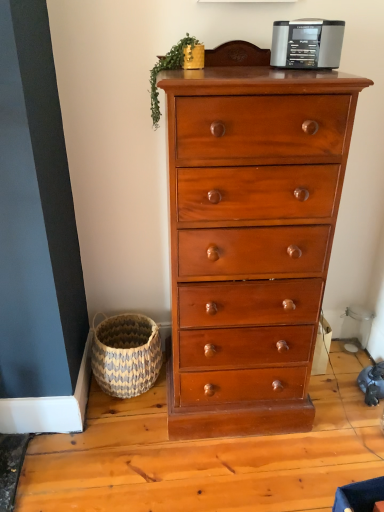
Where is `metallic gray radio at upper center`? This screenshot has width=384, height=512. metallic gray radio at upper center is located at coordinates (307, 42).

The height and width of the screenshot is (512, 384). Describe the element at coordinates (167, 69) in the screenshot. I see `green leafy plant at upper center` at that location.

You are a GUI agent. You are given a task and a screenshot of the screen. Output one action in this format:
    pyautogui.click(x=<x>, y=<y>)
    Task: Click on the metallic gray radio at upper center
    The image size is (384, 512).
    Given the screenshot: What is the action you would take?
    pyautogui.click(x=307, y=42)

From the image's perspective, which one is positioned lower, shiny brown wood chest of drawers at center or green leafy plant at upper center?

shiny brown wood chest of drawers at center appears lower in the image.

Looking at this image, is shiny brown wood chest of drawers at center further to camera compared to green leafy plant at upper center?

No, the depth of shiny brown wood chest of drawers at center is less than that of green leafy plant at upper center.

From a real-world perspective, which is physically below, shiny brown wood chest of drawers at center or green leafy plant at upper center?

shiny brown wood chest of drawers at center is physically lower.

Is woven natural basket at lower left far away from shiny brown wood chest of drawers at center?

No, there isn't a large distance between woven natural basket at lower left and shiny brown wood chest of drawers at center.

Is woven natural basket at lower left outside of shiny brown wood chest of drawers at center?

Yes.

Is woven natural basket at lower left oriented away from shiny brown wood chest of drawers at center?

No.

Can you confirm if woven natural basket at lower left is taller than shiny brown wood chest of drawers at center?

No.

Does metallic gray radio at upper center turn towards green leafy plant at upper center?

Result: No, metallic gray radio at upper center is not aimed at green leafy plant at upper center.

Locate an element on the screen. This screenshot has height=512, width=384. plant on the left of metallic gray radio at upper center is located at coordinates (167, 69).

Is shiny brown wood chest of drawers at center not close to woven natural basket at lower left?

No, shiny brown wood chest of drawers at center is not far away from woven natural basket at lower left.

From the image's perspective, does shiny brown wood chest of drawers at center appear lower than woven natural basket at lower left?

Incorrect, from the image's perspective, shiny brown wood chest of drawers at center is higher than woven natural basket at lower left.

Is shiny brown wood chest of drawers at center wider than woven natural basket at lower left?

Indeed, shiny brown wood chest of drawers at center has a greater width compared to woven natural basket at lower left.

Looking at the image, does shiny brown wood chest of drawers at center seem bigger or smaller compared to woven natural basket at lower left?

Clearly, shiny brown wood chest of drawers at center is larger in size than woven natural basket at lower left.

Is green leafy plant at upper center positioned with its back to woven natural basket at lower left?

No, green leafy plant at upper center is not facing away from woven natural basket at lower left.

Is point (183, 46) in front of point (140, 373)?

Yes.

Would you say woven natural basket at lower left is part of green leafy plant at upper center's contents?

That's incorrect, woven natural basket at lower left is not inside green leafy plant at upper center.

From a real-world perspective, which object rests below the other?

green leafy plant at upper center, from a real-world perspective.

Is green leafy plant at upper center positioned with its back to metallic gray radio at upper center?

green leafy plant at upper center is not turned away from metallic gray radio at upper center.

From the image's perspective, is green leafy plant at upper center under metallic gray radio at upper center?

Correct, green leafy plant at upper center appears lower than metallic gray radio at upper center in the image.

Consider the image. Between green leafy plant at upper center and metallic gray radio at upper center, which one is positioned in front?

metallic gray radio at upper center is more forward.

From the image's perspective, is shiny brown wood chest of drawers at center beneath metallic gray radio at upper center?

Yes, from the image's perspective, shiny brown wood chest of drawers at center is beneath metallic gray radio at upper center.

Considering the points (182, 96) and (305, 42), which point is in front, point (182, 96) or point (305, 42)?

Point (182, 96)

How far apart are shiny brown wood chest of drawers at center and metallic gray radio at upper center?

They are 49.90 centimeters apart.

Can you confirm if shiny brown wood chest of drawers at center is positioned to the right of metallic gray radio at upper center?

Incorrect, shiny brown wood chest of drawers at center is not on the right side of metallic gray radio at upper center.

You are a GUI agent. You are given a task and a screenshot of the screen. Output one action in this format:
    pyautogui.click(x=<x>, y=<y>)
    Task: Click on the plant above the shiny brown wood chest of drawers at center (from a real-world perspective)
    
    Given the screenshot: What is the action you would take?
    pyautogui.click(x=167, y=69)

Find the location of a particular element. The image size is (384, 512). basket that appears on the left of shiny brown wood chest of drawers at center is located at coordinates (126, 354).

Based on their spatial positions, is metallic gray radio at upper center or woven natural basket at lower left further from shiny brown wood chest of drawers at center?

metallic gray radio at upper center is positioned further to the anchor shiny brown wood chest of drawers at center.

Looking at the image, which one is located further to green leafy plant at upper center, woven natural basket at lower left or metallic gray radio at upper center?

Among the two, woven natural basket at lower left is located further to green leafy plant at upper center.

When comparing their distances from metallic gray radio at upper center, does woven natural basket at lower left or shiny brown wood chest of drawers at center seem closer?

shiny brown wood chest of drawers at center is closer to metallic gray radio at upper center.

Based on the photo, from the image, which object appears to be nearer to green leafy plant at upper center, metallic gray radio at upper center or shiny brown wood chest of drawers at center?

metallic gray radio at upper center lies closer to green leafy plant at upper center than the other object.

Based on the photo, when comparing their distances from shiny brown wood chest of drawers at center, does metallic gray radio at upper center or green leafy plant at upper center seem closer?

metallic gray radio at upper center is positioned closer to the anchor shiny brown wood chest of drawers at center.

Based on their spatial positions, is metallic gray radio at upper center or green leafy plant at upper center further from woven natural basket at lower left?

metallic gray radio at upper center is further to woven natural basket at lower left.

When comparing their distances from woven natural basket at lower left, does shiny brown wood chest of drawers at center or green leafy plant at upper center seem closer?

shiny brown wood chest of drawers at center lies closer to woven natural basket at lower left than the other object.

From the image, which object appears to be nearer to metallic gray radio at upper center, shiny brown wood chest of drawers at center or woven natural basket at lower left?

shiny brown wood chest of drawers at center.

Identify the location of chest of drawers between metallic gray radio at upper center and woven natural basket at lower left in the vertical direction. (250, 241).

Identify the location of plant that lies between metallic gray radio at upper center and shiny brown wood chest of drawers at center from top to bottom. Image resolution: width=384 pixels, height=512 pixels. (167, 69).

In order to click on chest of drawers between green leafy plant at upper center and woven natural basket at lower left in the up-down direction in this screenshot , I will do `click(250, 241)`.

I want to click on plant that lies between metallic gray radio at upper center and woven natural basket at lower left from top to bottom, so pyautogui.click(x=167, y=69).